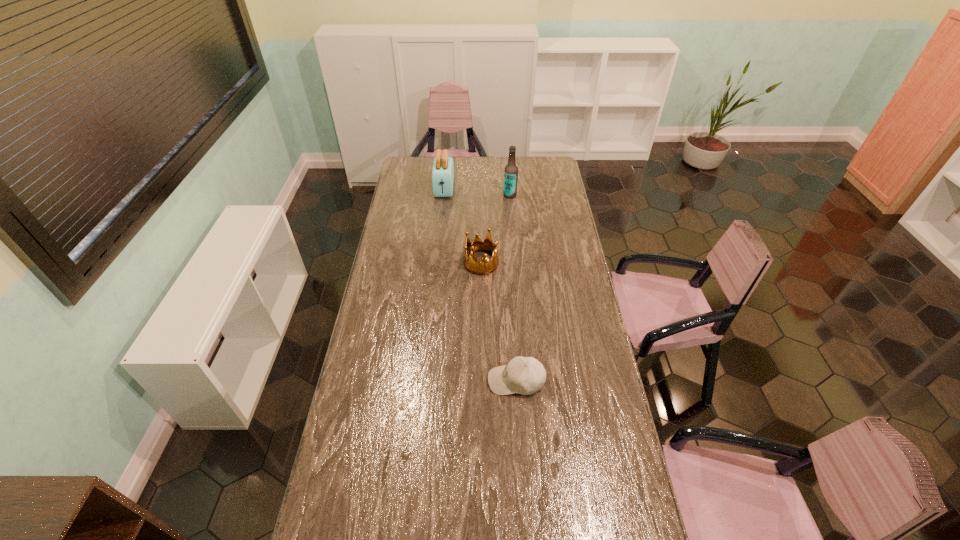
Where is `vacant position located on the side of the toaster with the lever`? vacant position located on the side of the toaster with the lever is located at coordinates (440, 232).

Locate an element on the screen. This screenshot has width=960, height=540. free region located on the right of the third farthest object is located at coordinates (574, 263).

Identify the location of vacant space located on the front-facing side of the shortest object. (439, 381).

The width and height of the screenshot is (960, 540). In order to click on vacant space situated on the front-facing side of the shortest object in this screenshot , I will do `click(383, 381)`.

You are a GUI agent. You are given a task and a screenshot of the screen. Output one action in this format:
    pyautogui.click(x=<x>, y=<y>)
    Task: Click on the free space located on the front-facing side of the shortest object
    The image size is (960, 540).
    Given the screenshot: What is the action you would take?
    pyautogui.click(x=386, y=381)

The image size is (960, 540). Find the location of `free location at the far edge of the desktop`. free location at the far edge of the desktop is located at coordinates (493, 160).

At what (x,y) coordinates should I click in order to perform the action: click on free space at the left edge of the desktop. Please return your answer as a coordinate pair (x, y). The image size is (960, 540). Looking at the image, I should click on (392, 222).

Where is `free space at the right edge`? free space at the right edge is located at coordinates (570, 296).

Where is `vacant space at the far left corner`? The width and height of the screenshot is (960, 540). vacant space at the far left corner is located at coordinates (423, 176).

Locate an element on the screen. vacant area at the far right corner of the desktop is located at coordinates (536, 172).